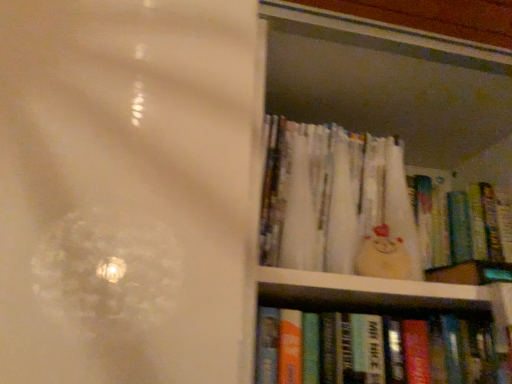
At what (x,y) coordinates should I click in order to perform the action: click on white paper book at upper right, the 3th book positioned from the bottom. Please return your answer as a coordinate pair (x, y). The width and height of the screenshot is (512, 384). Looking at the image, I should click on (371, 208).

Locate an element on the screen. This screenshot has height=384, width=512. matte plastic book at upper right, which is the second book from top to bottom is located at coordinates (459, 220).

What do you see at coordinates (459, 220) in the screenshot? This screenshot has height=384, width=512. I see `matte plastic book at upper right, which is the second book from top to bottom` at bounding box center [459, 220].

At what (x,y) coordinates should I click in order to perform the action: click on hardcover book at lower right, the 3th book viewed from the top. Please return your answer as a coordinate pair (x, y). The image size is (512, 384). Looking at the image, I should click on (382, 350).

This screenshot has height=384, width=512. What are the coordinates of `white paper book at upper right, which is the 1th book in top-to-bottom order` in the screenshot? It's located at (371, 208).

Measure the distance between hardcover books at right and white paper book at upper right, which is the 1th book in top-to-bottom order.

hardcover books at right and white paper book at upper right, which is the 1th book in top-to-bottom order, are 4.12 centimeters apart.

From a real-world perspective, which object rests below the other?

From a 3D spatial view, hardcover books at right is below.

In the scene shown: Would you say hardcover books at right is inside or outside white paper book at upper right, the 3th book positioned from the bottom?

hardcover books at right is outside white paper book at upper right, the 3th book positioned from the bottom.

Is hardcover books at right facing away from white paper book at upper right, the 3th book positioned from the bottom?

Correct, hardcover books at right is looking away from white paper book at upper right, the 3th book positioned from the bottom.

Choose the correct answer: Is white paper book at upper right, the 3th book positioned from the bottom, inside hardcover book at lower right, the 3th book viewed from the top, or outside it?

white paper book at upper right, the 3th book positioned from the bottom, exists outside the volume of hardcover book at lower right, the 3th book viewed from the top.

From a real-world perspective, count 2nd books upward from the hardcover book at lower right, which is the first book from bottom to top, and point to it. Please provide its 2D coordinates.

[(371, 208)]

Does white paper book at upper right, which is the 1th book in top-to-bottom order, have a greater width compared to hardcover book at lower right, the 3th book viewed from the top?

Indeed, white paper book at upper right, which is the 1th book in top-to-bottom order, has a greater width compared to hardcover book at lower right, the 3th book viewed from the top.

In the image, is white paper book at upper right, the 3th book positioned from the bottom, positioned in front of or behind hardcover book at lower right, which is the first book from bottom to top?

Clearly, white paper book at upper right, the 3th book positioned from the bottom, is behind hardcover book at lower right, which is the first book from bottom to top.

From a real-world perspective, is matte plastic book at upper right, the second book ordered from the bottom, physically below hardcover books at right?

No, from a real-world perspective, matte plastic book at upper right, the second book ordered from the bottom, is not beneath hardcover books at right.

How far apart are matte plastic book at upper right, the second book ordered from the bottom, and hardcover books at right?

matte plastic book at upper right, the second book ordered from the bottom, is 6.54 inches away from hardcover books at right.

Is matte plastic book at upper right, the second book ordered from the bottom, thinner than hardcover books at right?

Indeed, matte plastic book at upper right, the second book ordered from the bottom, has a lesser width compared to hardcover books at right.

Considering the positions of objects matte plastic book at upper right, the second book ordered from the bottom, and hardcover books at right in the image provided, who is more to the left, matte plastic book at upper right, the second book ordered from the bottom, or hardcover books at right?

Positioned to the left is hardcover books at right.

Based on the photo, is hardcover book at lower right, the 3th book viewed from the top, positioned before matte plastic book at upper right, the second book ordered from the bottom?

Yes, it is in front of matte plastic book at upper right, the second book ordered from the bottom.

From the image's perspective, count 1st books upward from the hardcover book at lower right, the 3th book viewed from the top, and point to it. Please provide its 2D coordinates.

[(459, 220)]

Considering the positions of objects matte plastic book at upper right, the second book ordered from the bottom, and hardcover book at lower right, the 3th book viewed from the top, in the image provided, who is more to the left, matte plastic book at upper right, the second book ordered from the bottom, or hardcover book at lower right, the 3th book viewed from the top,?

hardcover book at lower right, the 3th book viewed from the top, is more to the left.

Do you think matte plastic book at upper right, which is the second book from top to bottom, is within hardcover book at lower right, the 3th book viewed from the top, or outside of it?

matte plastic book at upper right, which is the second book from top to bottom, is located beyond the bounds of hardcover book at lower right, the 3th book viewed from the top.

Does matte plastic book at upper right, the second book ordered from the bottom, have a greater width compared to hardcover book at lower right, which is the first book from bottom to top?

In fact, matte plastic book at upper right, the second book ordered from the bottom, might be narrower than hardcover book at lower right, which is the first book from bottom to top.

In terms of size, does matte plastic book at upper right, which is the second book from top to bottom, appear bigger or smaller than hardcover book at lower right, the 3th book viewed from the top?

Considering their sizes, matte plastic book at upper right, which is the second book from top to bottom, takes up less space than hardcover book at lower right, the 3th book viewed from the top.

From a real-world perspective, is matte plastic book at upper right, which is the second book from top to bottom, beneath white paper book at upper right, which is the 1th book in top-to-bottom order?

Yes, from a real-world perspective, matte plastic book at upper right, which is the second book from top to bottom, is beneath white paper book at upper right, which is the 1th book in top-to-bottom order.

Does matte plastic book at upper right, the second book ordered from the bottom, appear on the right side of white paper book at upper right, which is the 1th book in top-to-bottom order?

Correct, you'll find matte plastic book at upper right, the second book ordered from the bottom, to the right of white paper book at upper right, which is the 1th book in top-to-bottom order.

Considering the positions of points (463, 213) and (434, 229), is point (463, 213) closer to camera compared to point (434, 229)?

No, (463, 213) is further to viewer.

Is matte plastic book at upper right, the second book ordered from the bottom, placed right next to white paper book at upper right, the 3th book positioned from the bottom?

They are not placed beside each other.

Is white paper book at upper right, the 3th book positioned from the bottom, positioned beyond the bounds of matte plastic book at upper right, the second book ordered from the bottom?

Indeed, white paper book at upper right, the 3th book positioned from the bottom, is completely outside matte plastic book at upper right, the second book ordered from the bottom.

From a real-world perspective, is white paper book at upper right, which is the 1th book in top-to-bottom order, above or below matte plastic book at upper right, the second book ordered from the bottom?

Clearly, from a real-world perspective, white paper book at upper right, which is the 1th book in top-to-bottom order, is above matte plastic book at upper right, the second book ordered from the bottom.

Starting from the matte plastic book at upper right, which is the second book from top to bottom, which book is the 2nd one to the left? Please provide its 2D coordinates.

[(371, 208)]

Considering the positions of point (365, 180) and point (479, 209), is point (365, 180) closer or farther from the camera than point (479, 209)?

Point (365, 180) is positioned closer to the camera compared to point (479, 209).

Identify the location of the 2nd book behind when counting from the hardcover books at right. The height and width of the screenshot is (384, 512). point(371,208).

Identify the location of the 2nd book located beneath the white paper book at upper right, the 3th book positioned from the bottom (from a real-world perspective). (382, 350).

When comparing their distances from hardcover book at lower right, the 3th book viewed from the top, does matte plastic book at upper right, the second book ordered from the bottom, or hardcover books at right seem closer?

The object closer to hardcover book at lower right, the 3th book viewed from the top, is hardcover books at right.

Which object lies further to the anchor point hardcover books at right, white paper book at upper right, the 3th book positioned from the bottom, or hardcover book at lower right, the 3th book viewed from the top?

Among the two, hardcover book at lower right, the 3th book viewed from the top, is located further to hardcover books at right.

In the scene shown: Which object lies nearer to the anchor point hardcover books at right, matte plastic book at upper right, the second book ordered from the bottom, or white paper book at upper right, the 3th book positioned from the bottom?

Among the two, white paper book at upper right, the 3th book positioned from the bottom, is located nearer to hardcover books at right.

Which object lies further to the anchor point white paper book at upper right, which is the 1th book in top-to-bottom order, hardcover books at right or matte plastic book at upper right, the second book ordered from the bottom?

The object further to white paper book at upper right, which is the 1th book in top-to-bottom order, is matte plastic book at upper right, the second book ordered from the bottom.

Estimate the real-world distances between objects in this image. Which object is closer to hardcover books at right, hardcover book at lower right, the 3th book viewed from the top, or matte plastic book at upper right, the second book ordered from the bottom?

matte plastic book at upper right, the second book ordered from the bottom.

Based on their spatial positions, is matte plastic book at upper right, which is the second book from top to bottom, or hardcover books at right closer to white paper book at upper right, the 3th book positioned from the bottom?

Based on the image, hardcover books at right appears to be nearer to white paper book at upper right, the 3th book positioned from the bottom.

Considering their positions, is hardcover book at lower right, which is the first book from bottom to top, positioned further to white paper book at upper right, the 3th book positioned from the bottom, than hardcover books at right?

Among the two, hardcover book at lower right, which is the first book from bottom to top, is located further to white paper book at upper right, the 3th book positioned from the bottom.

Which object lies further to the anchor point matte plastic book at upper right, the second book ordered from the bottom, white paper book at upper right, which is the 1th book in top-to-bottom order, or hardcover books at right?

hardcover books at right lies further to matte plastic book at upper right, the second book ordered from the bottom, than the other object.

The image size is (512, 384). What are the coordinates of `book between white paper book at upper right, which is the 1th book in top-to-bottom order, and matte plastic book at upper right, which is the second book from top to bottom` in the screenshot? It's located at (382, 350).

Where is `book between hardcover books at right and white paper book at upper right, which is the 1th book in top-to-bottom order, from front to back`? The height and width of the screenshot is (384, 512). book between hardcover books at right and white paper book at upper right, which is the 1th book in top-to-bottom order, from front to back is located at coordinates (382, 350).